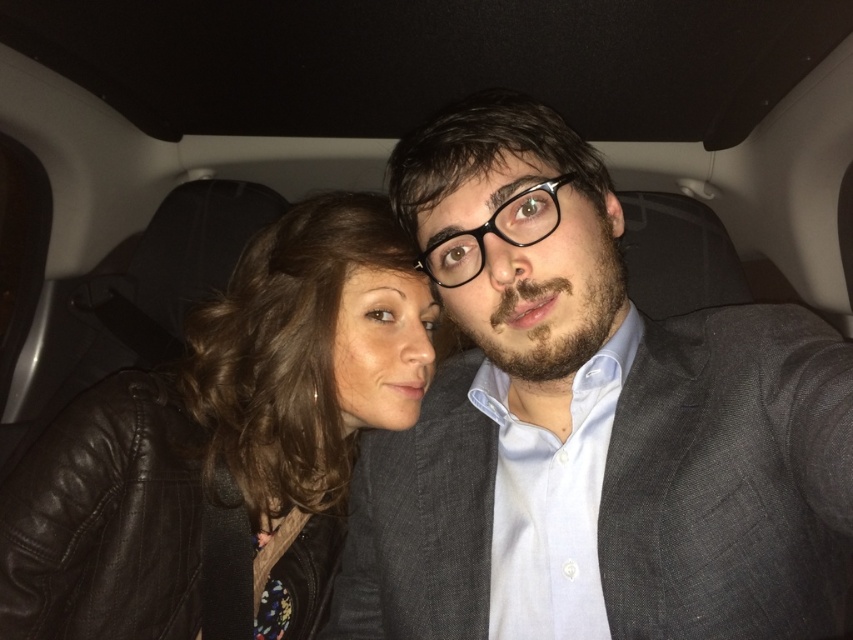
Can you confirm if gray textured suit at center is thinner than black leather jacket at left?

Incorrect, gray textured suit at center's width is not less than black leather jacket at left's.

Does point (427, 260) come in front of point (323, 422)?

Yes.

Locate an element on the screen. This screenshot has height=640, width=853. gray textured suit at center is located at coordinates (590, 426).